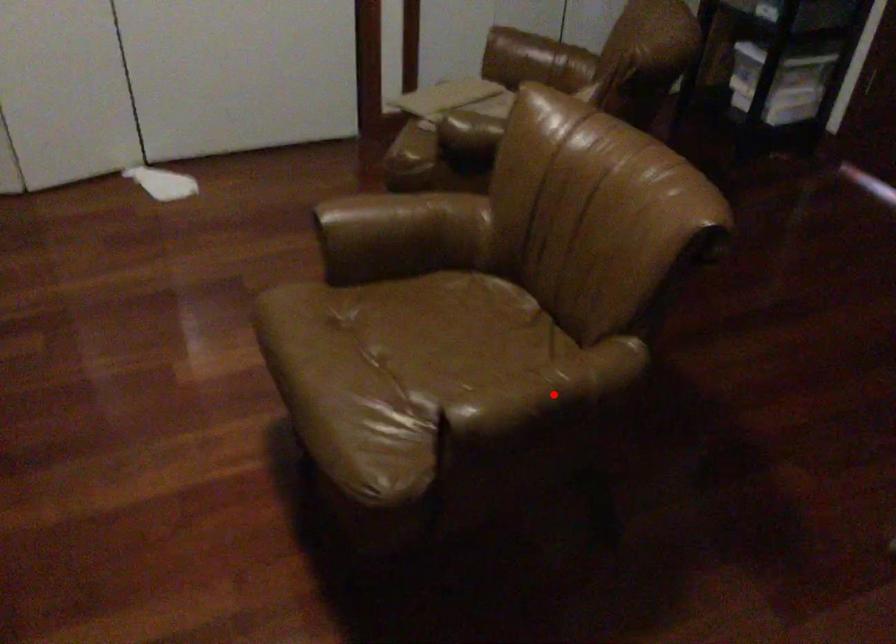
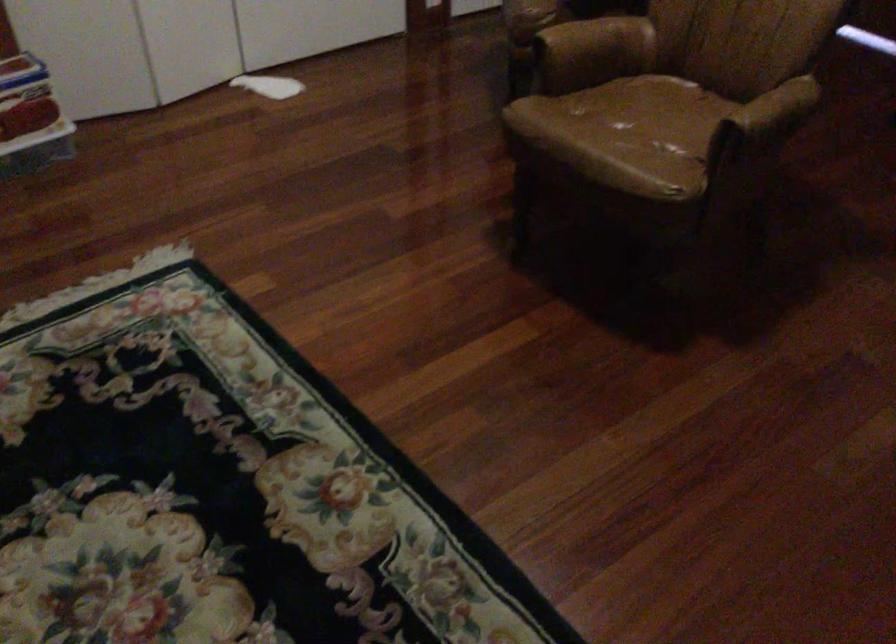
Question: A red point is marked in image1. In image2, is the corresponding 3D point closer to the camera or farther? Reply with the corresponding letter.

Choices:
 (A) The corresponding 3D point is closer.
 (B) The corresponding 3D point is farther.

Answer: (B)